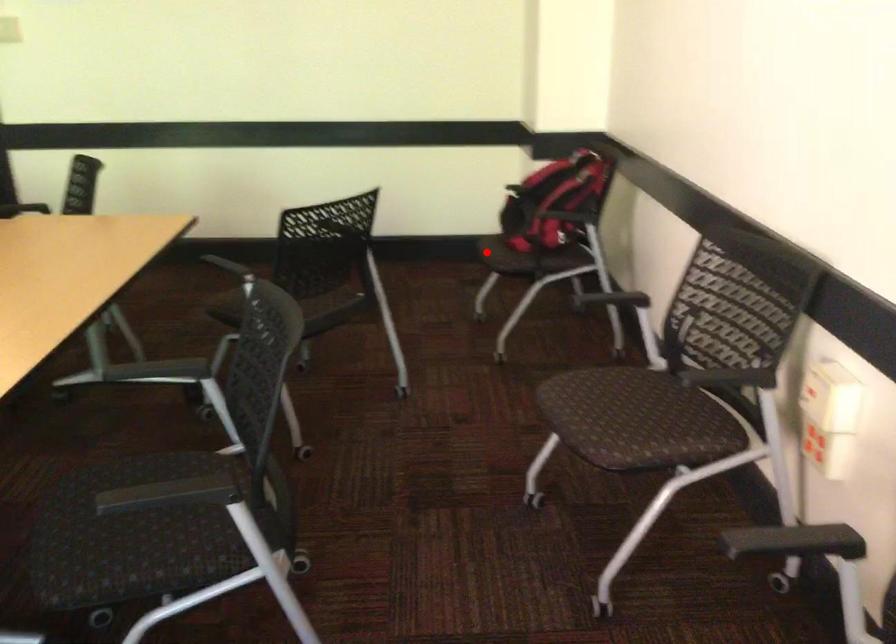
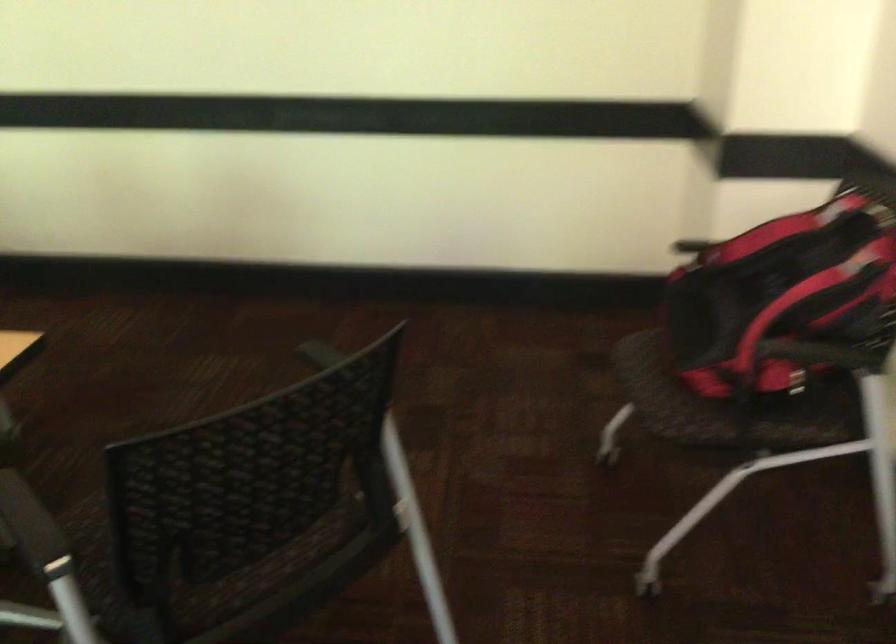
The point at the highlighted location is marked in the first image. Where is the corresponding point in the second image?

(647, 395)